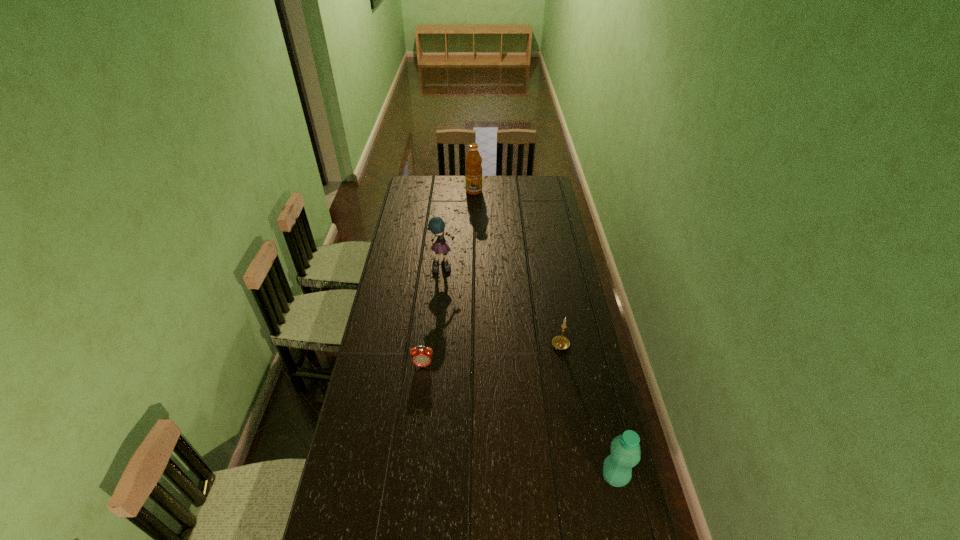
Identify the location of vacant space situated on the back of the nearest object. (600, 413).

You are a GUI agent. You are given a task and a screenshot of the screen. Output one action in this format:
    pyautogui.click(x=<x>, y=<y>)
    Task: Click on the free point located 0.050m on the front-facing side of the second farthest object
    The image size is (960, 540).
    Given the screenshot: What is the action you would take?
    pyautogui.click(x=452, y=281)

What are the coordinates of `blank space located on the front-facing side of the second farthest object` in the screenshot? It's located at (466, 311).

In order to click on vacant region located on the front-facing side of the second farthest object in this screenshot , I will do `click(468, 315)`.

Where is `blank area located 0.110m on the label side of the third object from left to right`? This screenshot has height=540, width=960. blank area located 0.110m on the label side of the third object from left to right is located at coordinates (477, 205).

Where is `free space located on the label side of the third object from left to right`? free space located on the label side of the third object from left to right is located at coordinates (480, 215).

Identify the location of free spot located on the label side of the third object from left to right. Image resolution: width=960 pixels, height=540 pixels. (479, 213).

Find the location of a particular element. This screenshot has width=960, height=540. vacant region located on the handle side of the second object from right to left is located at coordinates (523, 401).

Identify the location of vacant region located on the handle side of the second object from right to left. The image size is (960, 540). (531, 389).

Locate an element on the screen. The width and height of the screenshot is (960, 540). free space located 0.090m on the handle side of the second object from right to left is located at coordinates tap(546, 368).